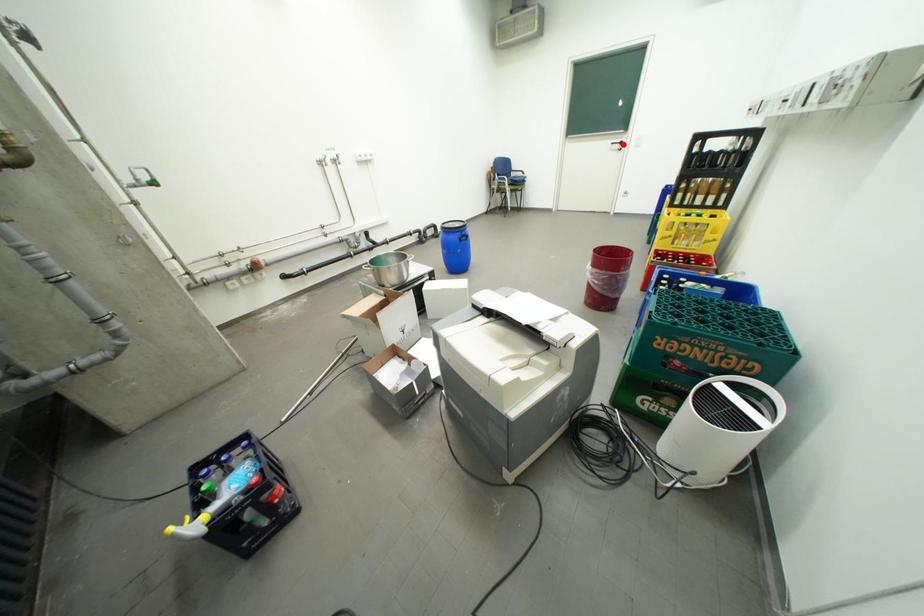
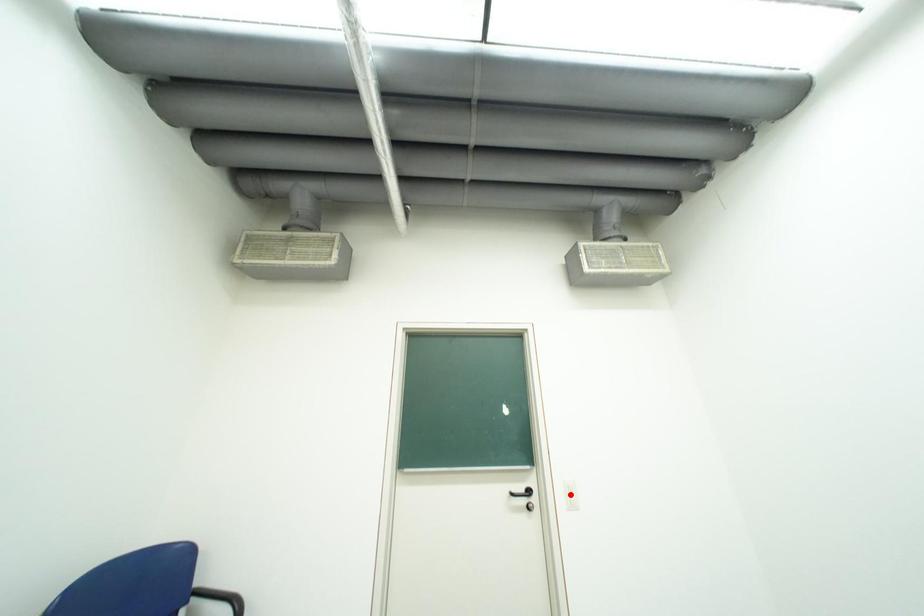
I am providing you with two images of the same scene from different viewpoints. A red point is marked on the first image and another point is marked on the second image. Is the red point in image1 aligned with the point shown in image2?

No